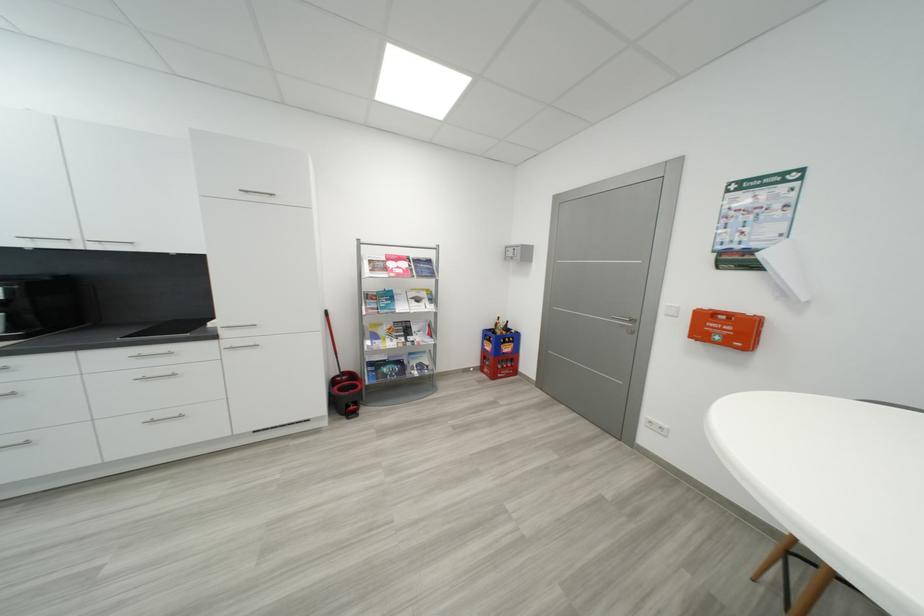
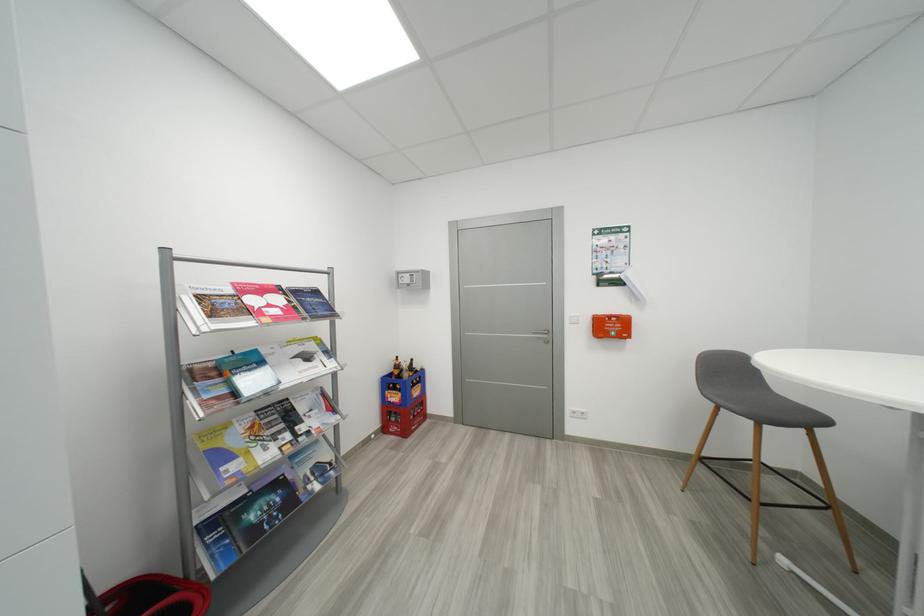
Locate, in the second image, the point that corresponds to pixel 497 331 in the first image.

(397, 377)